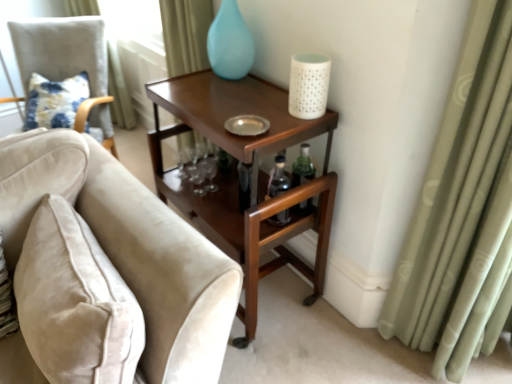
At what (x,y) coordinates should I click in order to perform the action: click on empty space that is in between matte blue glass vase at upper center and white textured candle at upper right. Please return your answer as a coordinate pair (x, y). The width and height of the screenshot is (512, 384). Looking at the image, I should click on (267, 94).